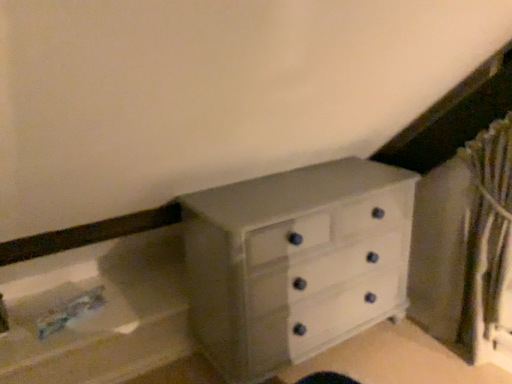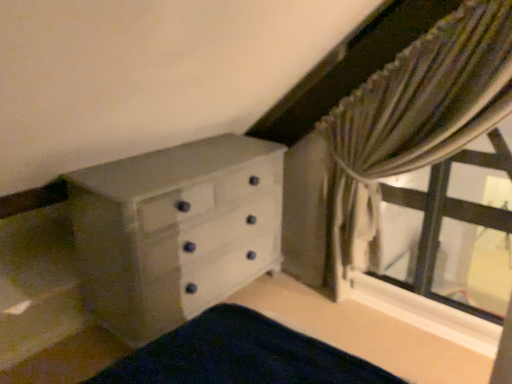
Question: How did the camera likely rotate when shooting the video?

Choices:
 (A) rotated right
 (B) rotated left

Answer: (A)